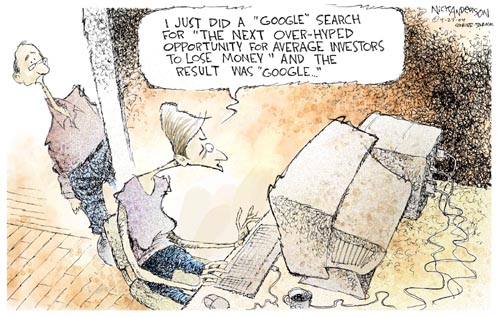
Locate an element on the screen. desktop computer tower is located at coordinates (411, 148).